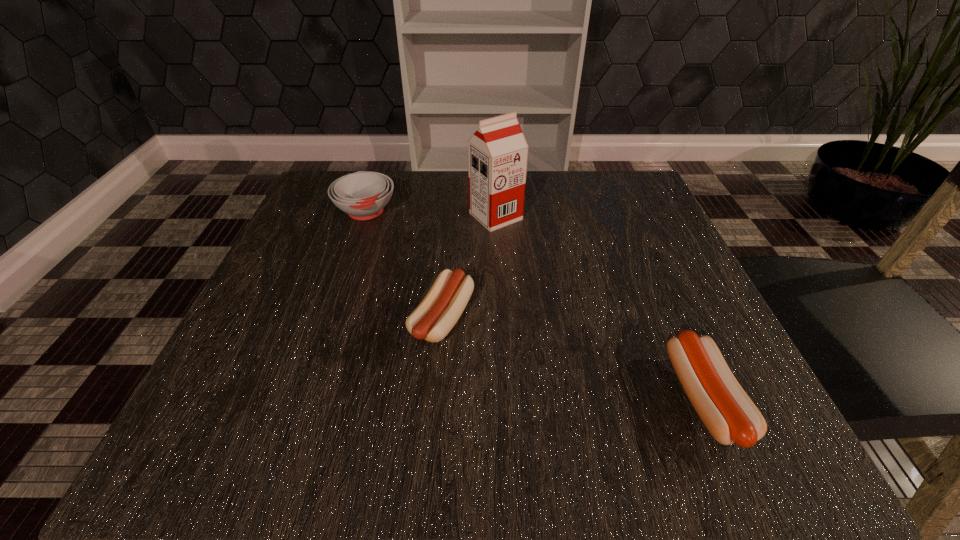
At what (x,y) coordinates should I click in order to perform the action: click on soup bowl present at the far edge. Please return your answer as a coordinate pair (x, y). Image resolution: width=960 pixels, height=540 pixels. Looking at the image, I should click on (363, 195).

Locate an element on the screen. object that is at the near edge is located at coordinates (728, 413).

Locate an element on the screen. object that is at the left edge is located at coordinates (363, 195).

The height and width of the screenshot is (540, 960). Identify the location of object positioned at the right edge. (728, 413).

This screenshot has height=540, width=960. Identify the location of object located at the far left corner. (363, 195).

Where is `object that is positioned at the near right corner`? The height and width of the screenshot is (540, 960). object that is positioned at the near right corner is located at coordinates (728, 413).

In the image, there is a desktop. Where is `vacant space at the far edge`? vacant space at the far edge is located at coordinates (446, 211).

In the image, there is a desktop. At what (x,y) coordinates should I click in order to perform the action: click on vacant region at the left edge. Please return your answer as a coordinate pair (x, y). Looking at the image, I should click on (299, 232).

The image size is (960, 540). I want to click on vacant area at the right edge of the desktop, so click(x=661, y=295).

You are a GUI agent. You are given a task and a screenshot of the screen. Output one action in this format:
    pyautogui.click(x=<x>, y=<y>)
    Task: Click on the free location at the far left corner of the desktop
    The height and width of the screenshot is (540, 960).
    Given the screenshot: What is the action you would take?
    pyautogui.click(x=322, y=191)